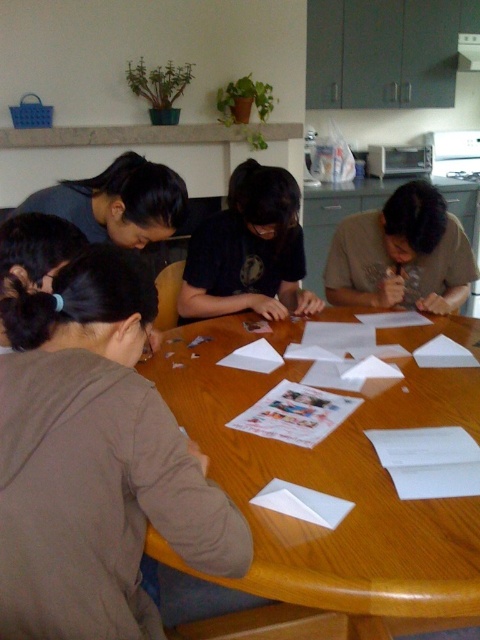
You are standing in the kitchen and need to reach both the point at coordinates (430, 243) and the point at coordinates (320, 515). Which point should you approach first to reach the closer one?

You should approach point (430, 243) first because it is closer to you than point (320, 515).

You are a photographer who wants to capture a clear photo of the white paper at center without any obstruction. Since the brown fabric shirt at lower left is in the way, can you adjust your position to take the photo? Explain why or why not based on their sizes.

The brown fabric shirt at lower left is much taller than the white paper at center. Since the shirt is taller, it would likely block the view of the white paper at center unless you move your camera position higher or angle it to avoid the obstruction caused by the shirt.

You are a photographer trying to capture a closeup of the white paper at center without including the brown matte shirt at center in the frame. Based on their positions, is this possible?

The brown matte shirt at center is positioned on the right side of white paper at center. Since the shirt is to the right of the paper, you can adjust your camera angle to the left side of the white paper at center to exclude the brown matte shirt at center from the frame.